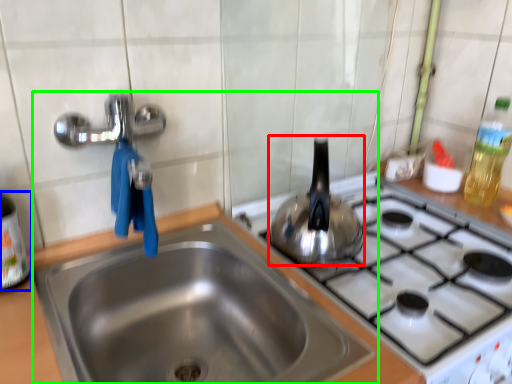
Question: Which object is positioned closest to tea pot (highlighted by a red box)? Select from bottle (highlighted by a blue box) and sink (highlighted by a green box).

Choices:
 (A) bottle
 (B) sink

Answer: (B)